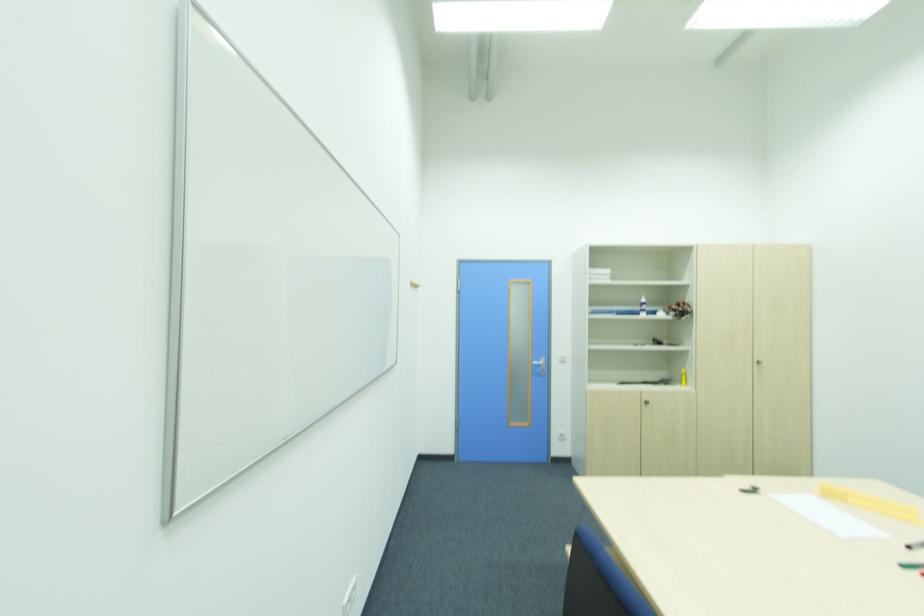
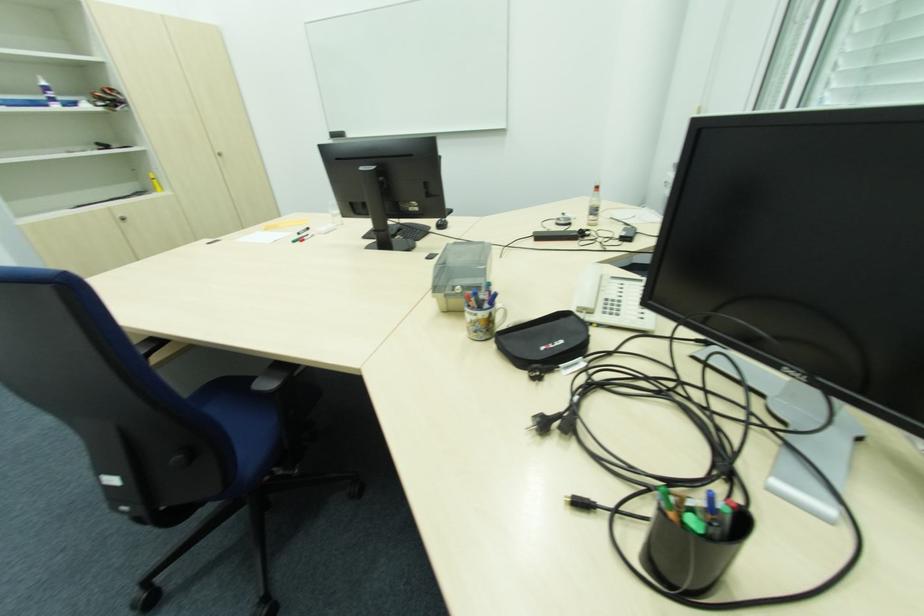
The first image is from the beginning of the video and the second image is from the end. How did the camera likely rotate when shooting the video?

The rotation direction of the camera is right-down.